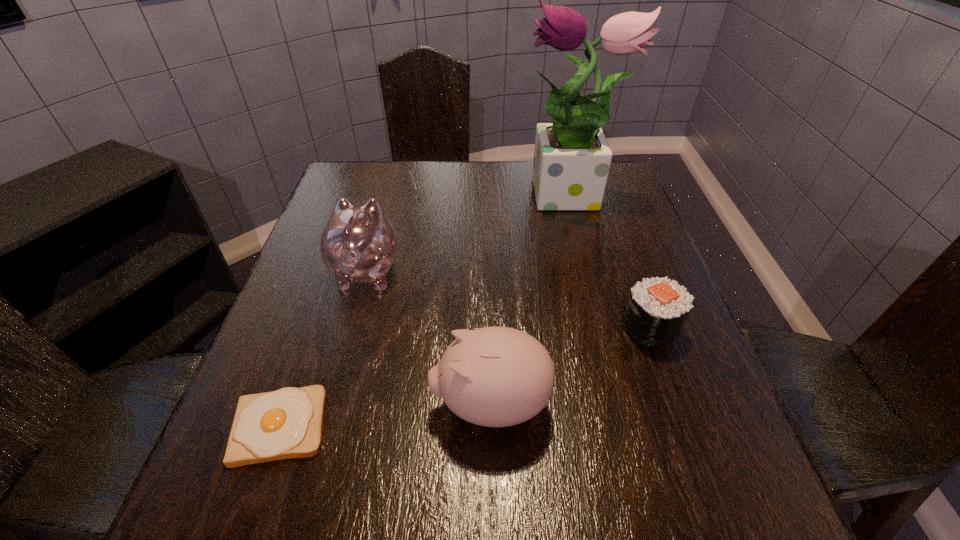
Where is `the closest object to the nearer piggy bank`? Image resolution: width=960 pixels, height=540 pixels. the closest object to the nearer piggy bank is located at coordinates (656, 309).

The image size is (960, 540). I want to click on vacant space that satisfies the following two spatial constraints: 1. on the front-facing side of the flower arrangement; 2. on the front side of the shortest object, so click(628, 426).

In order to click on free region that satisfies the following two spatial constraints: 1. on the front-facing side of the flower arrangement; 2. on the back side of the third nearest object in this screenshot , I will do `click(602, 328)`.